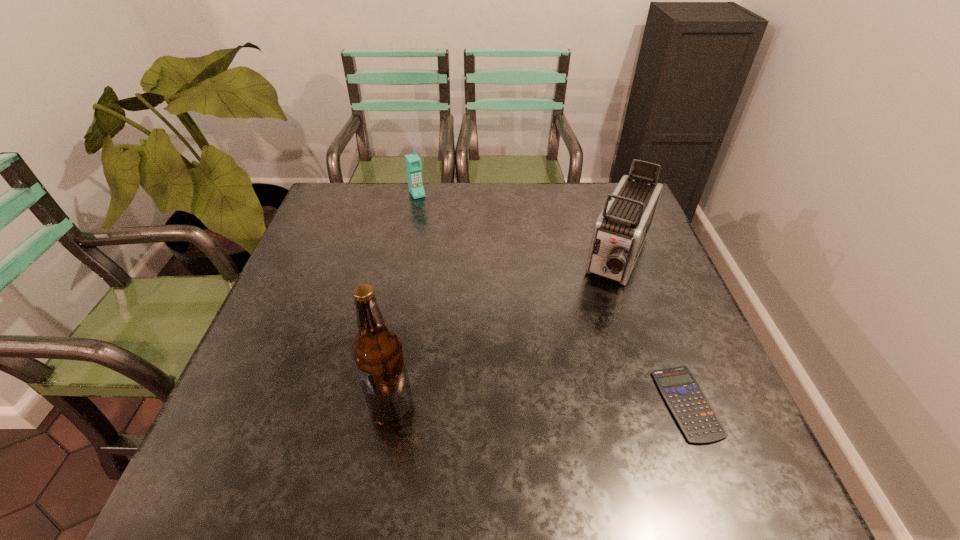
The width and height of the screenshot is (960, 540). I want to click on calculator that is at the right edge, so click(x=692, y=410).

The height and width of the screenshot is (540, 960). I want to click on camcorder present at the right edge, so click(x=620, y=231).

Where is `object located in the far right corner section of the desktop`? object located in the far right corner section of the desktop is located at coordinates (620, 231).

Locate an element on the screen. This screenshot has height=540, width=960. object present at the near right corner is located at coordinates (692, 410).

Where is `free space at the far edge`? This screenshot has height=540, width=960. free space at the far edge is located at coordinates (377, 220).

Find the location of a particular element. The height and width of the screenshot is (540, 960). vacant space at the near edge of the desktop is located at coordinates (456, 440).

The width and height of the screenshot is (960, 540). In the image, there is a desktop. What are the coordinates of `free space at the left edge` in the screenshot? It's located at (326, 302).

In the image, there is a desktop. Find the location of `free region at the right edge`. free region at the right edge is located at coordinates (636, 268).

Where is `vacant space at the near left corner`? vacant space at the near left corner is located at coordinates (287, 399).

Identify the location of free point between the second shortest object and the tallest object. (404, 300).